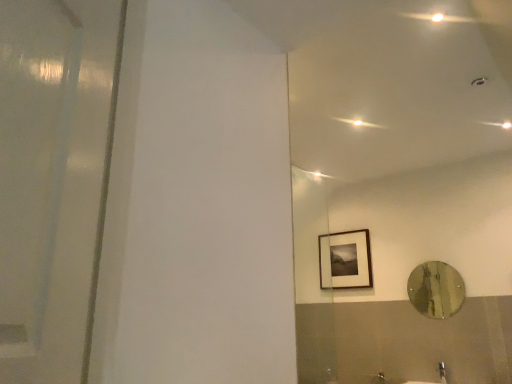
Question: Does metallic reflective mirror at right lie behind matte black picture frame at upper right?

Choices:
 (A) yes
 (B) no

Answer: (B)

Question: From a real-world perspective, is metallic reflective mirror at right located higher than matte black picture frame at upper right?

Choices:
 (A) no
 (B) yes

Answer: (A)

Question: Does metallic reflective mirror at right appear on the right side of matte black picture frame at upper right?

Choices:
 (A) yes
 (B) no

Answer: (A)

Question: Considering the relative sizes of metallic reflective mirror at right and matte black picture frame at upper right in the image provided, is metallic reflective mirror at right shorter than matte black picture frame at upper right?

Choices:
 (A) yes
 (B) no

Answer: (A)

Question: Is metallic reflective mirror at right smaller than matte black picture frame at upper right?

Choices:
 (A) no
 (B) yes

Answer: (B)

Question: Choose the correct answer: Is satin nickel faucet at lower right inside matte black picture frame at upper right or outside it?

Choices:
 (A) outside
 (B) inside

Answer: (A)

Question: Looking at the image, does satin nickel faucet at lower right seem bigger or smaller compared to matte black picture frame at upper right?

Choices:
 (A) small
 (B) big

Answer: (A)

Question: Considering the positions of satin nickel faucet at lower right and matte black picture frame at upper right in the image, is satin nickel faucet at lower right wider or thinner than matte black picture frame at upper right?

Choices:
 (A) wide
 (B) thin

Answer: (A)

Question: From a real-world perspective, is satin nickel faucet at lower right positioned above or below matte black picture frame at upper right?

Choices:
 (A) below
 (B) above

Answer: (A)

Question: Considering the positions of point (364, 231) and point (442, 375), is point (364, 231) closer or farther from the camera than point (442, 375)?

Choices:
 (A) farther
 (B) closer

Answer: (A)

Question: Is matte black picture frame at upper right spatially inside satin nickel faucet at lower right, or outside of it?

Choices:
 (A) inside
 (B) outside

Answer: (B)

Question: In terms of width, does matte black picture frame at upper right look wider or thinner when compared to satin nickel faucet at lower right?

Choices:
 (A) thin
 (B) wide

Answer: (A)

Question: Is matte black picture frame at upper right taller or shorter than satin nickel faucet at lower right?

Choices:
 (A) tall
 (B) short

Answer: (A)

Question: Based on their positions, is matte black picture frame at upper right located to the left or right of metallic reflective mirror at right?

Choices:
 (A) left
 (B) right

Answer: (A)

Question: In terms of size, does matte black picture frame at upper right appear bigger or smaller than metallic reflective mirror at right?

Choices:
 (A) big
 (B) small

Answer: (A)